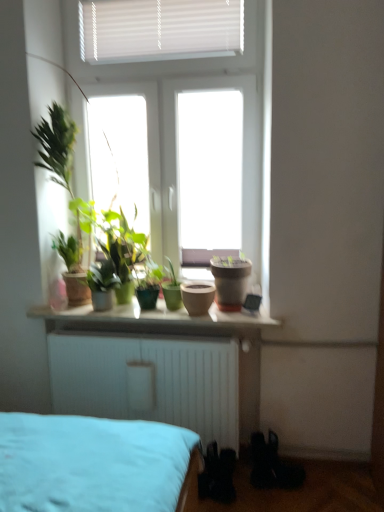
Question: Can we say matte brown pot at center, acting as the first flowerpot starting from the right, lies outside matte ceramic pots at center?

Choices:
 (A) yes
 (B) no

Answer: (A)

Question: Considering the relative positions of matte brown pot at center, the second flowerpot positioned from the left, and matte ceramic pots at center in the image provided, is matte brown pot at center, the second flowerpot positioned from the left, to the left of matte ceramic pots at center from the viewer's perspective?

Choices:
 (A) no
 (B) yes

Answer: (A)

Question: Is matte brown pot at center, the second flowerpot positioned from the left, next to matte ceramic pots at center?

Choices:
 (A) yes
 (B) no

Answer: (B)

Question: Does matte brown pot at center, acting as the first flowerpot starting from the right, have a larger size compared to matte ceramic pots at center?

Choices:
 (A) no
 (B) yes

Answer: (A)

Question: From the image's perspective, is matte brown pot at center, acting as the first flowerpot starting from the right, located above matte ceramic pots at center?

Choices:
 (A) yes
 (B) no

Answer: (A)

Question: Considering the positions of matte clay pot at center, the second flowerpot in the right-to-left sequence, and matte brown pot at center, the second flowerpot positioned from the left, in the image, is matte clay pot at center, the second flowerpot in the right-to-left sequence, taller or shorter than matte brown pot at center, the second flowerpot positioned from the left,?

Choices:
 (A) short
 (B) tall

Answer: (A)

Question: From a real-world perspective, is matte clay pot at center, the second flowerpot in the right-to-left sequence, above or below matte brown pot at center, the second flowerpot positioned from the left?

Choices:
 (A) below
 (B) above

Answer: (A)

Question: Considering the positions of matte clay pot at center, which is counted as the 1th flowerpot, starting from the left, and matte brown pot at center, the second flowerpot positioned from the left, in the image, is matte clay pot at center, which is counted as the 1th flowerpot, starting from the left, bigger or smaller than matte brown pot at center, the second flowerpot positioned from the left,?

Choices:
 (A) big
 (B) small

Answer: (B)

Question: Is matte clay pot at center, the second flowerpot in the right-to-left sequence, inside the boundaries of matte brown pot at center, the second flowerpot positioned from the left, or outside?

Choices:
 (A) inside
 (B) outside

Answer: (B)

Question: Is matte ceramic pots at center bigger or smaller than black matte shoe at lower right?

Choices:
 (A) small
 (B) big

Answer: (B)

Question: In terms of height, does matte ceramic pots at center look taller or shorter compared to black matte shoe at lower right?

Choices:
 (A) tall
 (B) short

Answer: (B)

Question: Is point (160, 300) positioned closer to the camera than point (296, 485)?

Choices:
 (A) closer
 (B) farther

Answer: (B)

Question: Is matte ceramic pots at center wider or thinner than black matte shoe at lower right?

Choices:
 (A) wide
 (B) thin

Answer: (A)

Question: In terms of width, does black matte shoe at lower right look wider or thinner when compared to matte ceramic pots at center?

Choices:
 (A) thin
 (B) wide

Answer: (A)

Question: Considering the positions of point (301, 476) and point (87, 308), is point (301, 476) closer or farther from the camera than point (87, 308)?

Choices:
 (A) farther
 (B) closer

Answer: (B)